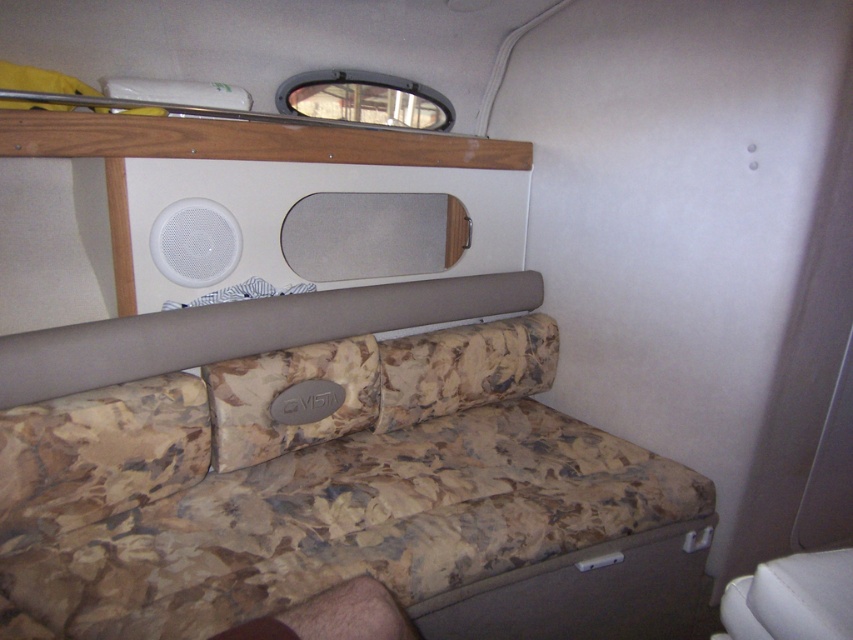
Measure the distance between camouflage fabric couch at center and camera.

4.32 feet

Does camouflage fabric couch at center lie in front of camouflage fabric pillow at center?

Yes, it is.

Is point (334, 348) positioned before point (318, 428)?

No, (334, 348) is further to viewer.

The height and width of the screenshot is (640, 853). In order to click on camouflage fabric couch at center in this screenshot , I will do `click(346, 499)`.

Consider the image. Is camouflage fabric couch at center wider than white plastic speaker at upper left?

Yes, camouflage fabric couch at center is wider than white plastic speaker at upper left.

Is camouflage fabric couch at center bigger than white plastic speaker at upper left?

Indeed, camouflage fabric couch at center has a larger size compared to white plastic speaker at upper left.

Where is `camouflage fabric couch at center`? Image resolution: width=853 pixels, height=640 pixels. camouflage fabric couch at center is located at coordinates (346, 499).

Find the location of a particular element. This screenshot has height=640, width=853. camouflage fabric couch at center is located at coordinates (346, 499).

Looking at this image, who is positioned more to the right, camouflage fabric pillow at center or white plastic speaker at upper left?

From the viewer's perspective, camouflage fabric pillow at center appears more on the right side.

Is camouflage fabric pillow at center thinner than white plastic speaker at upper left?

In fact, camouflage fabric pillow at center might be wider than white plastic speaker at upper left.

Describe the element at coordinates (279, 392) in the screenshot. I see `camouflage fabric pillow at center` at that location.

Locate an element on the screen. camouflage fabric pillow at center is located at coordinates (279, 392).